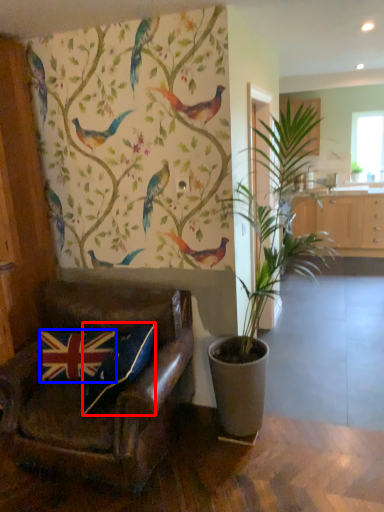
Question: Among these objects, which one is nearest to the camera, pillow (highlighted by a red box) or pillow (highlighted by a blue box)?

Choices:
 (A) pillow
 (B) pillow

Answer: (A)